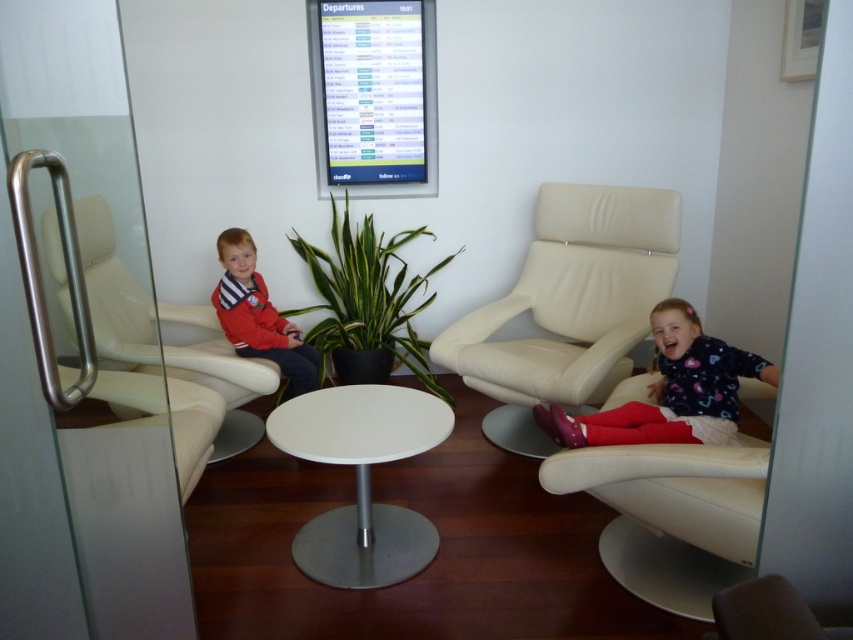
You are standing in the waiting area and need to place a small bag between the beige leather chair at right and the matte red jacket at left. Based on their positions, which object should the bag be closer to?

The beige leather chair at right is to the right of the matte red jacket at left, so the bag should be placed closer to the beige leather chair at right since it is positioned further to the right side of the area.

You are standing at the entrance of the waiting area and need to locate the beige leather chair at right. According to the coordinate system where the bottom left corner is the origin, can you determine its position?

The beige leather chair at right is located at point coordinates of (569, 307).